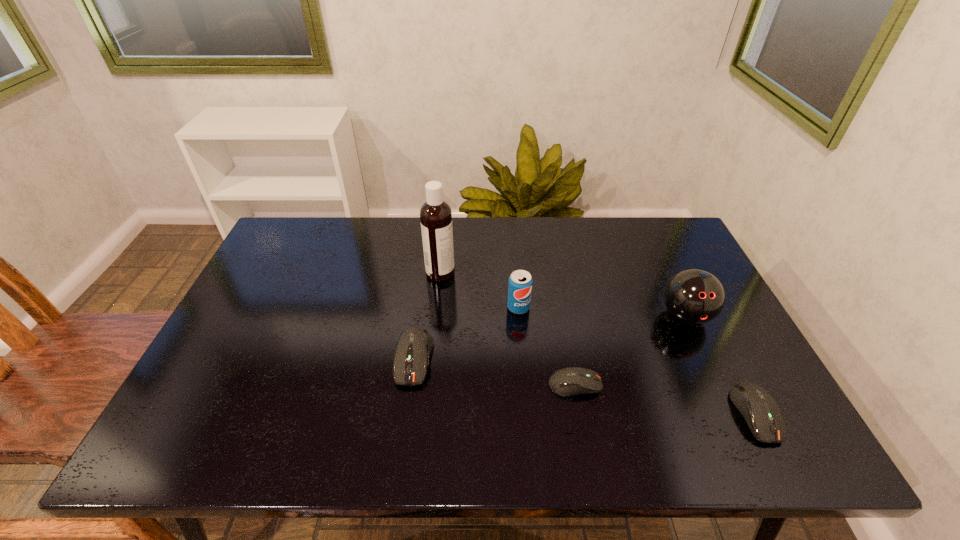
The computer equipments are evenly distributed in the image. To maintain this, where would you place another computer equipment on the left? Please point to a free space. Please provide its 2D coordinates. Your answer should be formatted as a tuple, i.e. [(x, y)], where the tuple contains the x and y coordinates of a point satisfying the conditions above.

[(268, 335)]